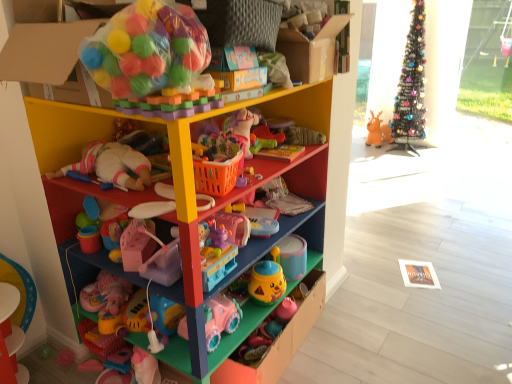
Question: Is translucent plastic ball pit at upper left, placed as the sixth toy when sorted from back to front, at the left side of pink plastic toy car at lower center, the fifth toy when ordered from right to left?

Choices:
 (A) no
 (B) yes

Answer: (B)

Question: Can you confirm if translucent plastic ball pit at upper left, placed as the sixth toy when sorted from back to front, is smaller than pink plastic toy car at lower center, which is counted as the second toy, starting from the left?

Choices:
 (A) no
 (B) yes

Answer: (A)

Question: Considering the relative sizes of translucent plastic ball pit at upper left, the fifth toy positioned from the bottom, and pink plastic toy car at lower center, which is the 1th toy in bottom-to-top order, in the image provided, is translucent plastic ball pit at upper left, the fifth toy positioned from the bottom, bigger than pink plastic toy car at lower center, which is the 1th toy in bottom-to-top order,?

Choices:
 (A) yes
 (B) no

Answer: (A)

Question: Is the surface of translucent plastic ball pit at upper left, placed as the sixth toy when sorted from back to front, in direct contact with pink plastic toy car at lower center, which ranks as the 5th toy in back-to-front order?

Choices:
 (A) yes
 (B) no

Answer: (B)

Question: Can you confirm if translucent plastic ball pit at upper left, which is counted as the sixth toy, starting from the right, is taller than pink plastic toy car at lower center, which ranks as the 5th toy in back-to-front order?

Choices:
 (A) no
 (B) yes

Answer: (B)

Question: Is yellow matte cup at center, arranged as the 3th toy when viewed from the back, situated inside pink plastic toy at center, the 4th toy viewed from the back, or outside?

Choices:
 (A) inside
 (B) outside

Answer: (B)

Question: From their relative heights in the image, would you say yellow matte cup at center, acting as the 3th toy starting from the right, is taller or shorter than pink plastic toy at center, positioned as the third toy in front-to-back order?

Choices:
 (A) tall
 (B) short

Answer: (A)

Question: From a real-world perspective, relative to pink plastic toy at center, positioned as the third toy in front-to-back order, is yellow matte cup at center, the 4th toy in the front-to-back sequence, vertically above or below?

Choices:
 (A) above
 (B) below

Answer: (B)

Question: Is yellow matte cup at center, arranged as the 5th toy when viewed from the top, in front of or behind pink plastic toy at center, the 3th toy positioned from the bottom, in the image?

Choices:
 (A) behind
 (B) front

Answer: (A)

Question: From the image's perspective, is yellow matte cup at center, the 4th toy in the front-to-back sequence, positioned above or below matte plastic drawer at center?

Choices:
 (A) above
 (B) below

Answer: (A)

Question: Do you think yellow matte cup at center, the fourth toy in the left-to-right sequence, is within matte plastic drawer at center, or outside of it?

Choices:
 (A) outside
 (B) inside

Answer: (A)

Question: Looking at the image, does yellow matte cup at center, acting as the 3th toy starting from the right, seem bigger or smaller compared to matte plastic drawer at center?

Choices:
 (A) small
 (B) big

Answer: (A)

Question: Considering the positions of point (279, 266) and point (286, 336), is point (279, 266) closer or farther from the camera than point (286, 336)?

Choices:
 (A) farther
 (B) closer

Answer: (A)

Question: Relative to pink plastic toy at center, the 4th toy viewed from the back, is metallic wire christmas tree at upper right in front or behind?

Choices:
 (A) behind
 (B) front

Answer: (A)

Question: In terms of width, does metallic wire christmas tree at upper right look wider or thinner when compared to pink plastic toy at center, the 3th toy positioned from the bottom?

Choices:
 (A) wide
 (B) thin

Answer: (A)